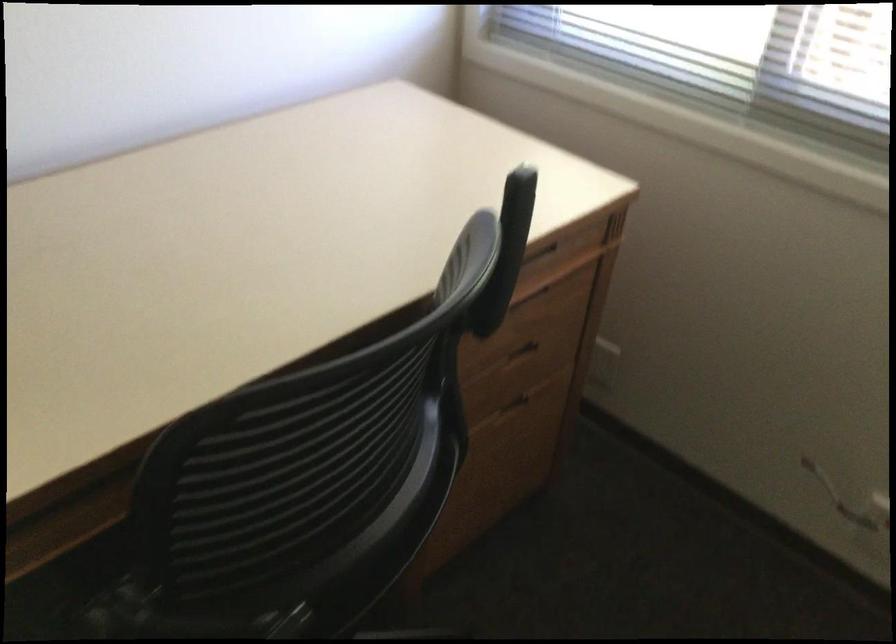
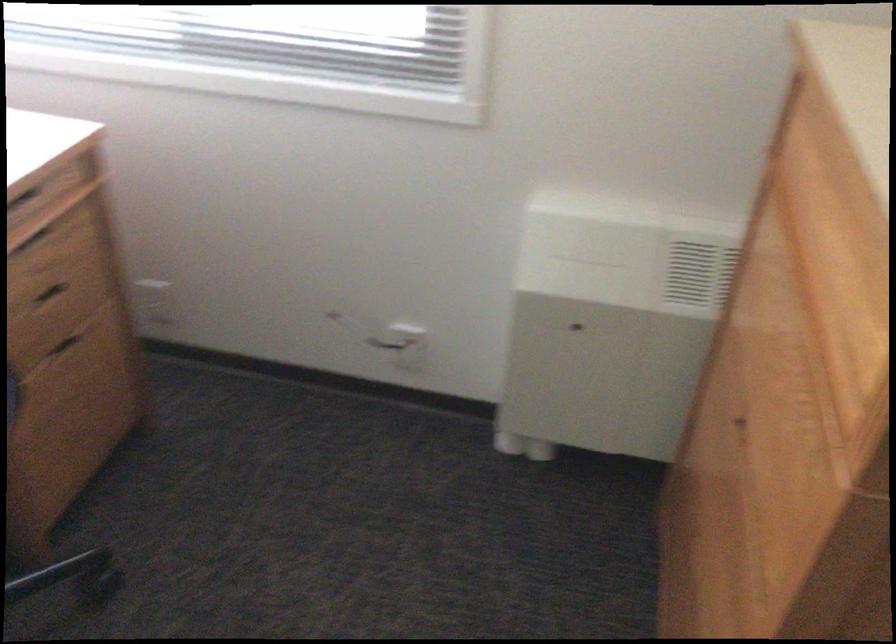
Find the pixel in the second image that matches (x=607, y=348) in the first image.

(153, 299)